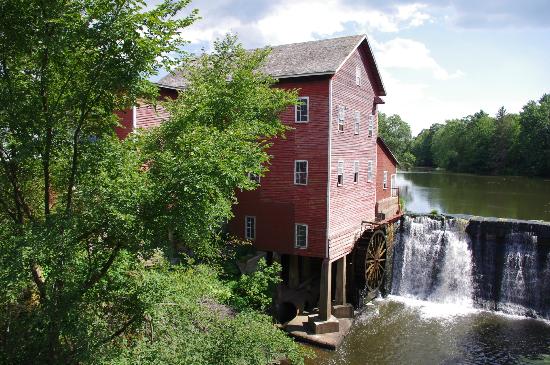
I want to click on columns holding up house, so click(x=316, y=324), click(x=346, y=312), click(x=290, y=280), click(x=269, y=259), click(x=305, y=269).